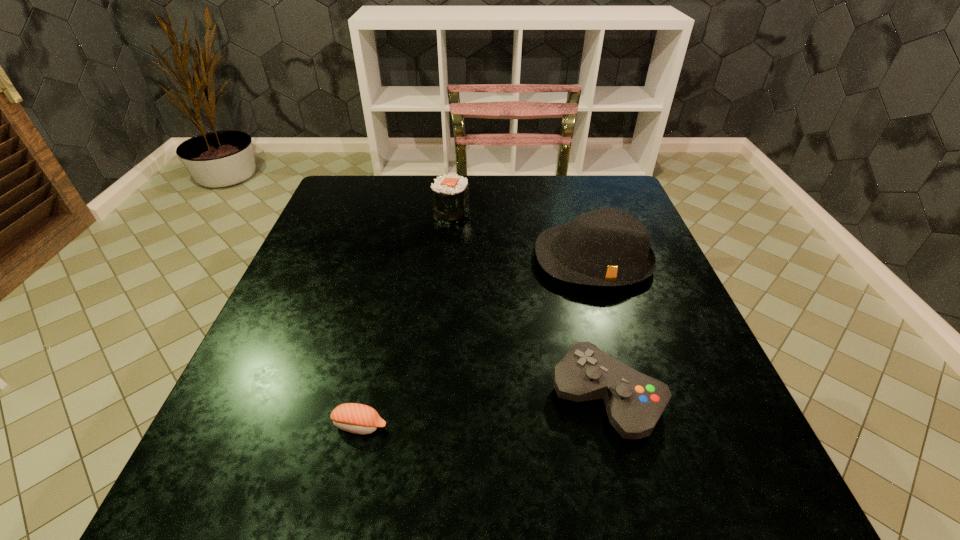
Where is `blank area located on the back of the shorter sushi`? Image resolution: width=960 pixels, height=540 pixels. blank area located on the back of the shorter sushi is located at coordinates (396, 265).

The height and width of the screenshot is (540, 960). I want to click on object at the far edge, so click(450, 193).

Locate an element on the screen. Image resolution: width=960 pixels, height=540 pixels. fedora that is at the right edge is located at coordinates (608, 247).

Image resolution: width=960 pixels, height=540 pixels. Find the location of `control present at the right edge`. control present at the right edge is located at coordinates tap(634, 402).

This screenshot has height=540, width=960. Find the location of `free space at the far edge of the desktop`. free space at the far edge of the desktop is located at coordinates (425, 219).

Where is `vacant space at the near edge of the desktop`? This screenshot has height=540, width=960. vacant space at the near edge of the desktop is located at coordinates (358, 495).

The height and width of the screenshot is (540, 960). What are the coordinates of `free space at the left edge of the desktop` in the screenshot? It's located at (308, 424).

Identify the location of free space at the right edge. The height and width of the screenshot is (540, 960). (684, 319).

Find the location of a particular element. The height and width of the screenshot is (540, 960). blank area at the far left corner is located at coordinates (340, 216).

Identify the location of vacant point located between the control and the nearer sushi. The image size is (960, 540). (483, 411).